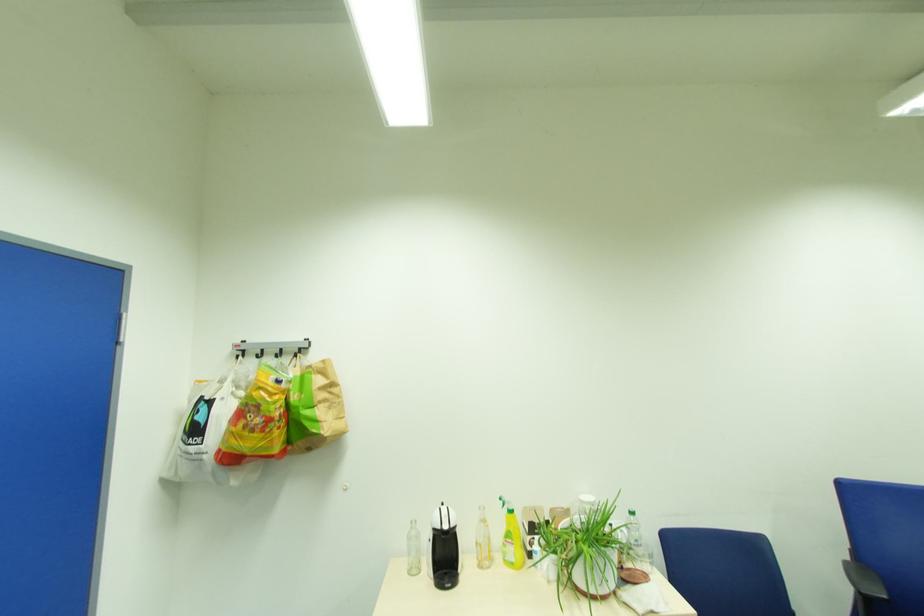
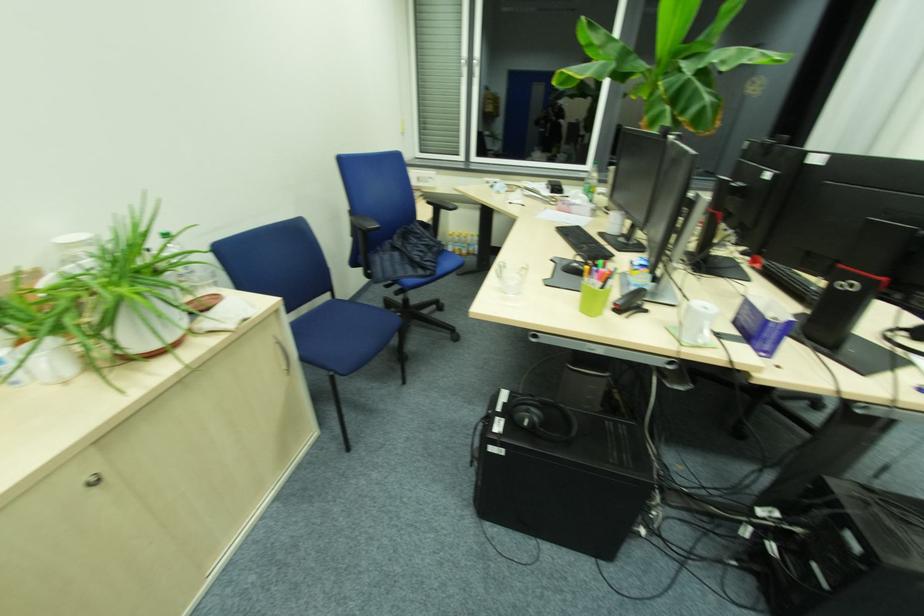
The images are taken continuously from a first-person perspective. In which direction is your viewpoint rotating?

The rotation direction of the camera is right-down.